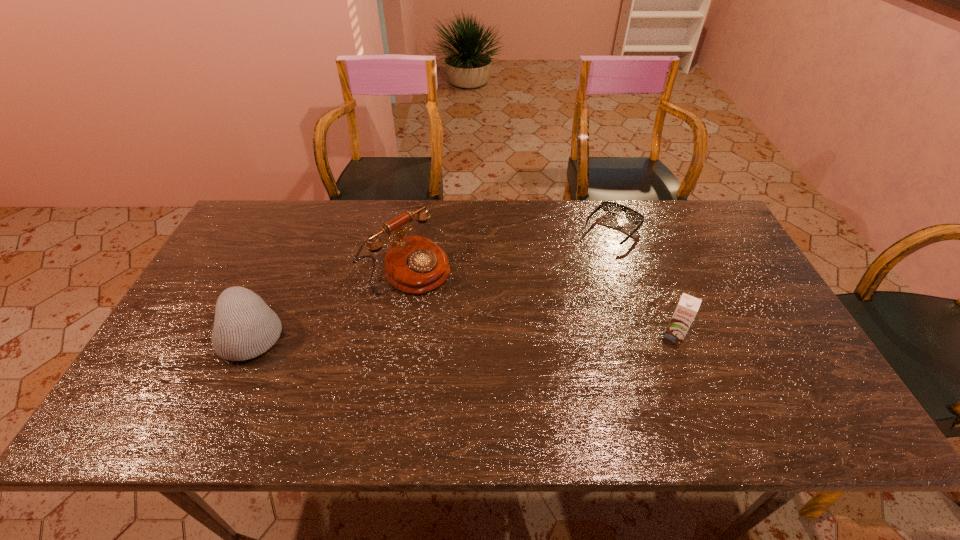
Locate an element on the screen. This screenshot has width=960, height=540. beanie is located at coordinates (245, 327).

Identify the location of chocolate milk. This screenshot has height=540, width=960. (687, 308).

You are a GUI agent. You are given a task and a screenshot of the screen. Output one action in this format:
    pyautogui.click(x=<x>, y=<y>)
    Task: Click on the telephone
    
    Given the screenshot: What is the action you would take?
    pyautogui.click(x=413, y=264)

Locate an element on the screen. The height and width of the screenshot is (540, 960). the tallest object is located at coordinates (413, 264).

This screenshot has width=960, height=540. Identify the location of sunglasses. (610, 208).

I want to click on free space located 0.260m on the back of the leftmost object, so click(x=294, y=244).

This screenshot has height=540, width=960. Find the location of `free space located on the left of the chocolate milk`. free space located on the left of the chocolate milk is located at coordinates (568, 335).

What are the coordinates of `vacant area located 0.130m on the dial of the telephone` in the screenshot? It's located at (470, 311).

Image resolution: width=960 pixels, height=540 pixels. Find the location of `free space located on the dial of the telephone`. free space located on the dial of the telephone is located at coordinates (454, 300).

Locate an element on the screen. vacant space situated 0.380m on the dial of the telephone is located at coordinates (544, 365).